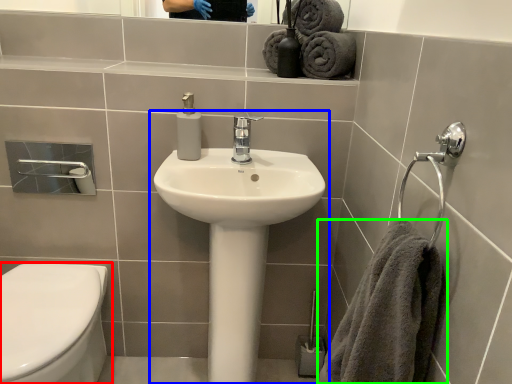
Question: Estimate the real-world distances between objects in this image. Which object is farther from toilet (highlighted by a red box), sink (highlighted by a blue box) or towel (highlighted by a green box)?

Choices:
 (A) sink
 (B) towel

Answer: (B)